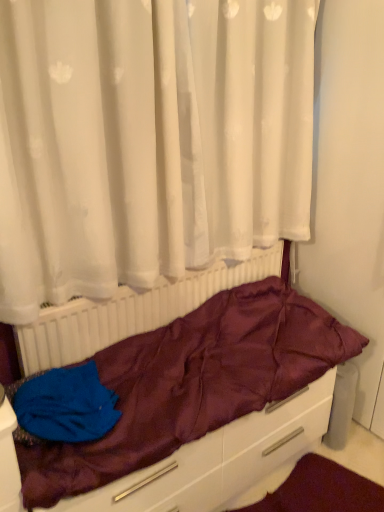
Where is `free location above white plastic radiator at center (from a real-world perspective)`? free location above white plastic radiator at center (from a real-world perspective) is located at coordinates (184, 266).